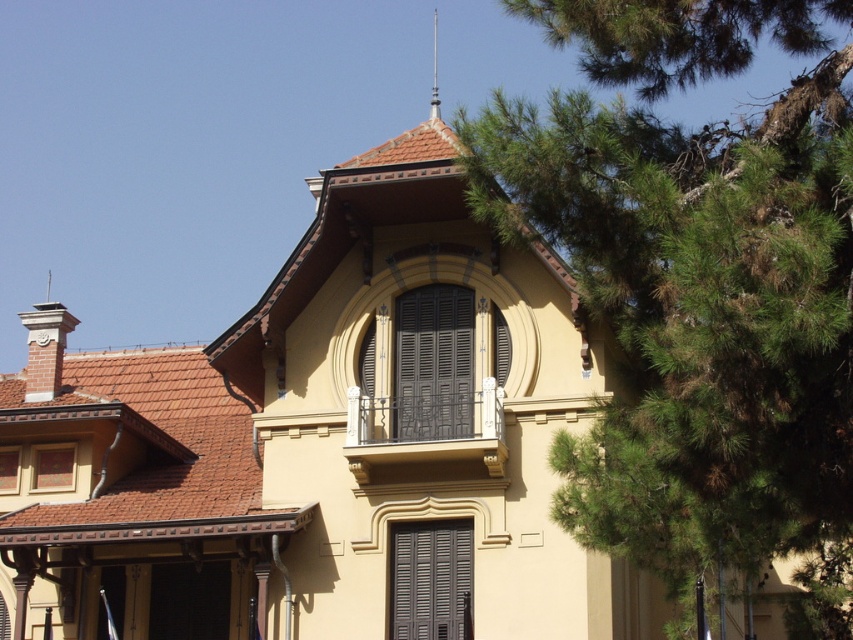
Question: Can you confirm if green leafy tree at upper right is wider than polished silver spire at upper center?

Choices:
 (A) no
 (B) yes

Answer: (B)

Question: Which object is the closest to the green leafy tree at upper right?

Choices:
 (A) polished silver spire at upper center
 (B) dark gray matte shutters at center

Answer: (B)

Question: Does matte black shutters at center appear on the left side of dark gray matte shutters at center?

Choices:
 (A) no
 (B) yes

Answer: (B)

Question: Which point appears farthest from the camera in this image?

Choices:
 (A) (433, 74)
 (B) (625, 132)
 (C) (460, 298)
 (D) (422, 620)

Answer: (A)

Question: Is green leafy tree at upper right above matte black shutters at center?

Choices:
 (A) yes
 (B) no

Answer: (B)

Question: Which point is closer to the camera taking this photo?

Choices:
 (A) (467, 388)
 (B) (786, 310)
 (C) (437, 104)

Answer: (B)